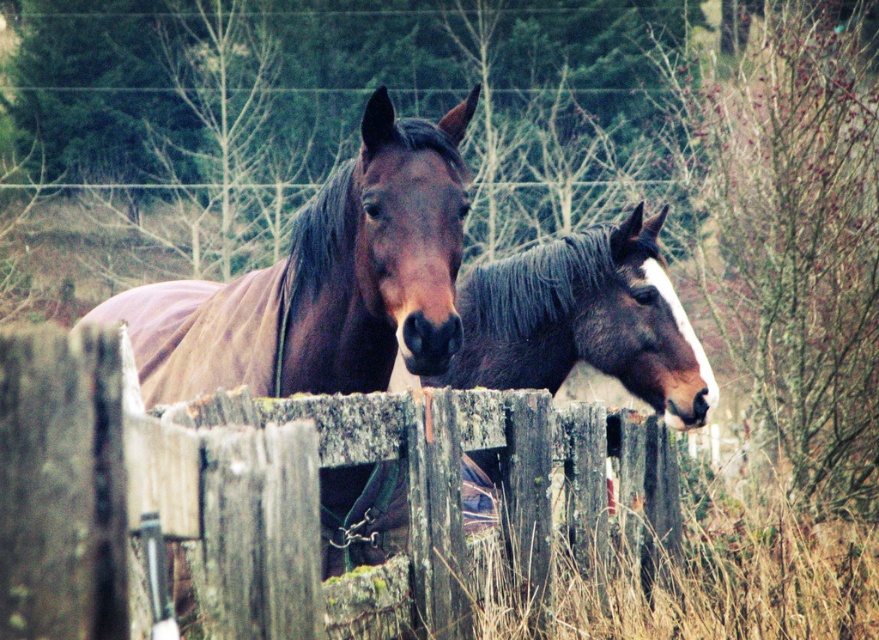
Does weathered wood fence at center come behind shiny brown horse at center?

Yes, it is behind shiny brown horse at center.

Does weathered wood fence at center have a greater height compared to shiny brown horse at center?

Incorrect, weathered wood fence at center's height is not larger of shiny brown horse at center's.

Is point (520, 416) in front of point (447, 204)?

No.

Image resolution: width=879 pixels, height=640 pixels. Identify the location of weathered wood fence at center. (258, 492).

Which is in front, point (154, 397) or point (672, 336)?

Positioned in front is point (154, 397).

Image resolution: width=879 pixels, height=640 pixels. I want to click on shiny brown horse at center, so click(325, 280).

Locate an element on the screen. shiny brown horse at center is located at coordinates (325, 280).

Where is `shiny brown horse at center`? Image resolution: width=879 pixels, height=640 pixels. shiny brown horse at center is located at coordinates (325, 280).

The width and height of the screenshot is (879, 640). What do you see at coordinates (258, 492) in the screenshot?
I see `weathered wood fence at center` at bounding box center [258, 492].

Which is more to the right, weathered wood fence at center or brown glossy horse at center?

weathered wood fence at center is more to the right.

Who is more distant from viewer, (137, 513) or (656, 340)?

The point (656, 340) is more distant.

Where is `weathered wood fence at center`? weathered wood fence at center is located at coordinates (258, 492).